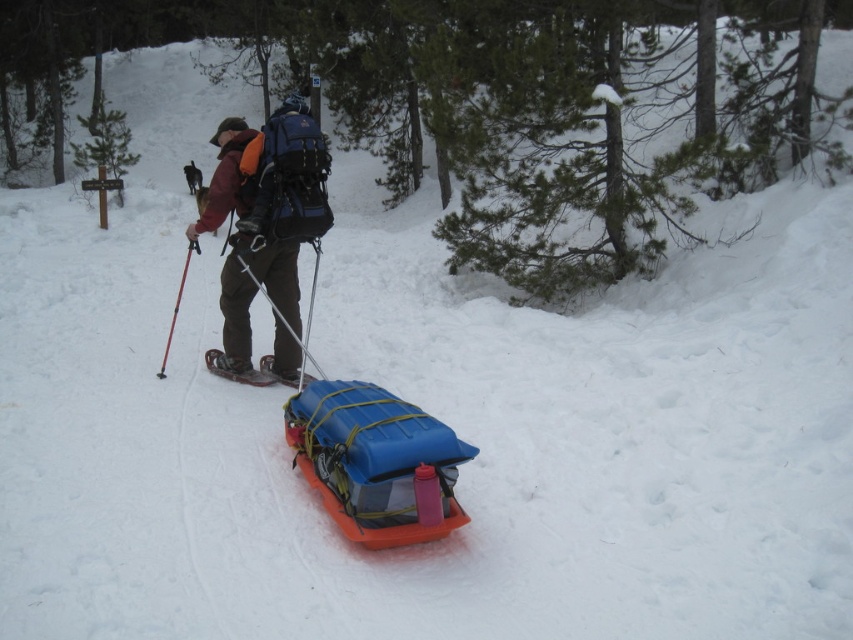
Question: Considering the relative positions of matte black backpack at center and metallic snowshoe at center in the image provided, where is matte black backpack at center located with respect to metallic snowshoe at center?

Choices:
 (A) below
 (B) above

Answer: (B)

Question: Does matte black backpack at center have a lesser width compared to metallic snowshoe at center?

Choices:
 (A) yes
 (B) no

Answer: (A)

Question: Which point is farther from the camera taking this photo?

Choices:
 (A) (244, 257)
 (B) (256, 381)

Answer: (B)

Question: Which object appears farthest from the camera in this image?

Choices:
 (A) metallic snowshoe at center
 (B) matte black backpack at center

Answer: (A)

Question: Can you confirm if matte black backpack at center is thinner than metallic snowshoe at center?

Choices:
 (A) yes
 (B) no

Answer: (A)